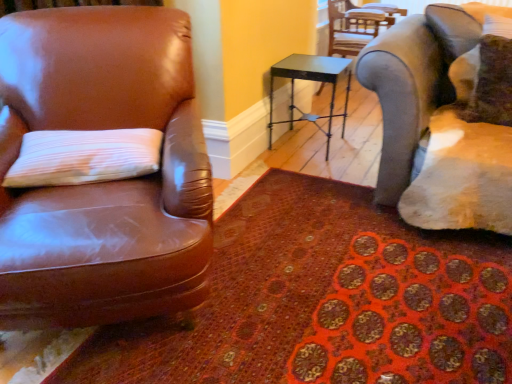
What do you see at coordinates (84, 157) in the screenshot? Image resolution: width=512 pixels, height=384 pixels. I see `white textured pillow at left, the second pillow in the back-to-front sequence` at bounding box center [84, 157].

The height and width of the screenshot is (384, 512). What are the coordinates of `velvet brown pillow at upper right, positioned as the 2th pillow in bottom-to-top order` in the screenshot? It's located at (487, 83).

The width and height of the screenshot is (512, 384). I want to click on metallic gray chair at upper right, the 2th chair ordered from the bottom, so click(x=351, y=28).

Describe the element at coordinates (323, 301) in the screenshot. The width and height of the screenshot is (512, 384). I see `patterned carpet at lower left` at that location.

What do you see at coordinates (105, 182) in the screenshot? This screenshot has height=384, width=512. I see `brown leather chair at left, marked as the 1th chair in a bottom-to-top arrangement` at bounding box center [105, 182].

The image size is (512, 384). Identify the location of white textured pillow at left, arranged as the second pillow when viewed from the top. (84, 157).

Does velvet brown pillow at upper right, arranged as the 2th pillow when viewed from the front, appear on the left side of metallic black table at center?

No.

In the scene shown: From a real-world perspective, is velvet brown pillow at upper right, which appears as the first pillow when viewed from the right, physically located above or below metallic black table at center?

In terms of real-world spatial position, velvet brown pillow at upper right, which appears as the first pillow when viewed from the right, is above metallic black table at center.

Is velvet brown pillow at upper right, positioned as the 2th pillow in bottom-to-top order, next to metallic black table at center?

No, velvet brown pillow at upper right, positioned as the 2th pillow in bottom-to-top order, is not beside metallic black table at center.

At what (x,y) coordinates should I click in order to perform the action: click on table in front of the metallic gray chair at upper right, the 1th chair viewed from the top. Please return your answer as a coordinate pair (x, y). This screenshot has width=512, height=384. Looking at the image, I should click on (310, 80).

Can you confirm if metallic black table at center is thinner than metallic gray chair at upper right, the 2th chair from the front?

Indeed, metallic black table at center has a lesser width compared to metallic gray chair at upper right, the 2th chair from the front.

How much distance is there between metallic black table at center and metallic gray chair at upper right, placed as the 1th chair when sorted from back to front?

23.59 inches.

Is metallic black table at center not near metallic gray chair at upper right, the 2th chair from the front?

No, metallic black table at center is not far from metallic gray chair at upper right, the 2th chair from the front.

Visually, is metallic gray chair at upper right, the 2th chair positioned from the left, positioned to the left or to the right of patterned carpet at lower left?

Based on their positions, metallic gray chair at upper right, the 2th chair positioned from the left, is located to the right of patterned carpet at lower left.

Looking at this image, is metallic gray chair at upper right, the 2th chair positioned from the left, closer to camera compared to patterned carpet at lower left?

No, metallic gray chair at upper right, the 2th chair positioned from the left, is behind patterned carpet at lower left.

Looking at this image, does metallic gray chair at upper right, placed as the 1th chair when sorted from back to front, have a larger size compared to patterned carpet at lower left?

Yes.

Is metallic gray chair at upper right, the 1th chair viewed from the top, wider or thinner than patterned carpet at lower left?

In the image, metallic gray chair at upper right, the 1th chair viewed from the top, appears to be more narrow than patterned carpet at lower left.

The image size is (512, 384). Identify the location of table behind the brown leather chair at left, marked as the 1th chair in a bottom-to-top arrangement. (310, 80).

Who is more distant, metallic black table at center or brown leather chair at left, marked as the 1th chair in a bottom-to-top arrangement?

metallic black table at center is behind.

Is brown leather chair at left, marked as the 1th chair in a bottom-to-top arrangement, a part of metallic black table at center?

Actually, brown leather chair at left, marked as the 1th chair in a bottom-to-top arrangement, is outside metallic black table at center.

Looking at this image, from the image's perspective, does metallic black table at center appear higher than brown leather chair at left, marked as the 1th chair in a bottom-to-top arrangement?

Yes, from the image's perspective, metallic black table at center is on top of brown leather chair at left, marked as the 1th chair in a bottom-to-top arrangement.

Is metallic gray chair at upper right, the 2th chair from the front, closer to camera compared to metallic black table at center?

No, the depth of metallic gray chair at upper right, the 2th chair from the front, is greater than that of metallic black table at center.

From the image's perspective, which is below, metallic gray chair at upper right, acting as the first chair starting from the right, or metallic black table at center?

metallic black table at center.

Can you tell me how much metallic gray chair at upper right, the 2th chair positioned from the left, and metallic black table at center differ in facing direction?

4.89 degrees separate the facing orientations of metallic gray chair at upper right, the 2th chair positioned from the left, and metallic black table at center.

Could you tell me if metallic gray chair at upper right, the 1th chair viewed from the top, is turned towards metallic black table at center?

No, metallic gray chair at upper right, the 1th chair viewed from the top, is not facing towards metallic black table at center.

Is brown leather chair at left, acting as the 1th chair starting from the front, closer to camera compared to white textured pillow at left, the first pillow when ordered from bottom to top?

Yes.

Is brown leather chair at left, the first chair from the left, turned away from white textured pillow at left, the first pillow when ordered from bottom to top?

That's right, brown leather chair at left, the first chair from the left, is facing away from white textured pillow at left, the first pillow when ordered from bottom to top.

Can you confirm if brown leather chair at left, which is the second chair in top-to-bottom order, is shorter than white textured pillow at left, which is the 1th pillow in front-to-back order?

In fact, brown leather chair at left, which is the second chair in top-to-bottom order, may be taller than white textured pillow at left, which is the 1th pillow in front-to-back order.

Is brown leather chair at left, which is the second chair in top-to-bottom order, behind metallic black table at center?

No, brown leather chair at left, which is the second chair in top-to-bottom order, is closer to the viewer.

From the image's perspective, is brown leather chair at left, acting as the 2th chair starting from the back, located above or below metallic black table at center?

brown leather chair at left, acting as the 2th chair starting from the back, is below metallic black table at center.

The width and height of the screenshot is (512, 384). Find the location of `pillow that is the 1st object located in front of the metallic black table at center`. pillow that is the 1st object located in front of the metallic black table at center is located at coordinates (487, 83).

Identify the location of chair lying on the right of metallic black table at center. (351, 28).

Based on the photo, from the image, which object appears to be nearer to white textured pillow at left, the second pillow in the back-to-front sequence, brown leather chair at left, which is the second chair in top-to-bottom order, or patterned carpet at lower left?

brown leather chair at left, which is the second chair in top-to-bottom order, lies closer to white textured pillow at left, the second pillow in the back-to-front sequence, than the other object.

Based on their spatial positions, is patterned carpet at lower left or white textured pillow at left, positioned as the 1th pillow in left-to-right order, closer to velvet brown pillow at upper right, the 1th pillow in the back-to-front sequence?

patterned carpet at lower left is positioned closer to the anchor velvet brown pillow at upper right, the 1th pillow in the back-to-front sequence.

Which object lies further to the anchor point white textured pillow at left, the first pillow when ordered from bottom to top, metallic black table at center or brown leather chair at left, the 2th chair in the right-to-left sequence?

metallic black table at center is positioned further to the anchor white textured pillow at left, the first pillow when ordered from bottom to top.

Considering their positions, is metallic gray chair at upper right, the 2th chair positioned from the left, positioned closer to brown leather chair at left, the first chair from the left, than patterned carpet at lower left?

patterned carpet at lower left.

When comparing their distances from brown leather chair at left, which is the second chair in top-to-bottom order, does metallic gray chair at upper right, the 2th chair from the front, or white textured pillow at left, positioned as the 1th pillow in left-to-right order, seem closer?

white textured pillow at left, positioned as the 1th pillow in left-to-right order, is closer to brown leather chair at left, which is the second chair in top-to-bottom order.

Which object lies further to the anchor point patterned carpet at lower left, velvet brown pillow at upper right, arranged as the 2th pillow when viewed from the front, or brown leather chair at left, the first chair from the left?

Among the two, velvet brown pillow at upper right, arranged as the 2th pillow when viewed from the front, is located further to patterned carpet at lower left.

Looking at the image, which one is located closer to patterned carpet at lower left, white textured pillow at left, arranged as the second pillow when viewed from the top, or velvet brown pillow at upper right, arranged as the 2th pillow when viewed from the front?

Among the two, white textured pillow at left, arranged as the second pillow when viewed from the top, is located nearer to patterned carpet at lower left.

When comparing their distances from metallic gray chair at upper right, the 2th chair ordered from the bottom, does patterned carpet at lower left or velvet brown pillow at upper right, which appears as the first pillow when viewed from the right, seem further?

Based on the image, patterned carpet at lower left appears to be further to metallic gray chair at upper right, the 2th chair ordered from the bottom.

The image size is (512, 384). Identify the location of table between white textured pillow at left, positioned as the 2th pillow in right-to-left order, and metallic gray chair at upper right, the 2th chair ordered from the bottom, in the front-back direction. (310, 80).

The height and width of the screenshot is (384, 512). I want to click on chair located between patterned carpet at lower left and metallic black table at center in the depth direction, so click(x=105, y=182).

The image size is (512, 384). I want to click on table between white textured pillow at left, positioned as the 1th pillow in left-to-right order, and velvet brown pillow at upper right, which appears as the first pillow when viewed from the right, in the horizontal direction, so click(x=310, y=80).

Find the location of a particular element. The image size is (512, 384). chair between white textured pillow at left, positioned as the 1th pillow in left-to-right order, and patterned carpet at lower left, in the horizontal direction is located at coordinates (105, 182).